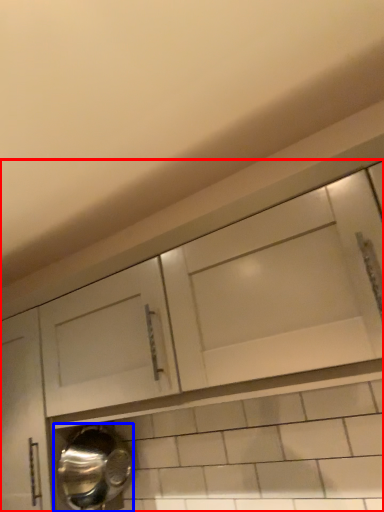
Question: Which object appears closest to the camera in this image, cabinetry (highlighted by a red box) or water heater (highlighted by a blue box)?

Choices:
 (A) cabinetry
 (B) water heater

Answer: (A)